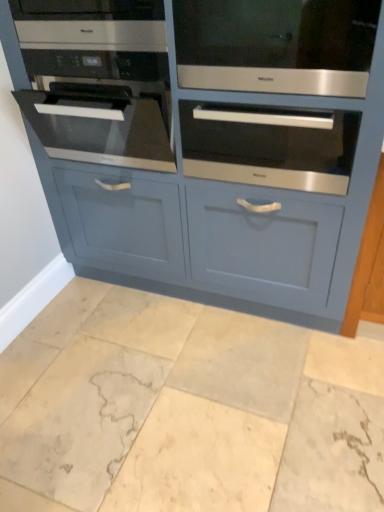
Question: Is matte blue cabinet at center directly adjacent to satin silver oven at center, which appears as the third oven when viewed from the left?

Choices:
 (A) yes
 (B) no

Answer: (B)

Question: Is matte blue cabinet at center thinner than satin silver oven at center, the 1th oven from the right?

Choices:
 (A) no
 (B) yes

Answer: (A)

Question: Is the position of matte blue cabinet at center more distant than that of satin silver oven at center, which appears as the third oven when viewed from the left?

Choices:
 (A) no
 (B) yes

Answer: (A)

Question: From a real-world perspective, is matte blue cabinet at center positioned over satin silver oven at center, which appears as the third oven when viewed from the left, based on gravity?

Choices:
 (A) no
 (B) yes

Answer: (A)

Question: From a real-world perspective, is matte blue cabinet at center under satin silver oven at center, the 1th oven from the right?

Choices:
 (A) no
 (B) yes

Answer: (B)

Question: Is matte blue cabinet at center facing away from satin silver oven at center, which appears as the third oven when viewed from the left?

Choices:
 (A) yes
 (B) no

Answer: (A)

Question: Is satin black oven at left, placed as the first oven when sorted from left to right, at the left side of satin silver oven at upper center, which is the 2th oven in left-to-right order?

Choices:
 (A) yes
 (B) no

Answer: (A)

Question: Is satin black oven at left, placed as the first oven when sorted from left to right, aimed at satin silver oven at upper center, which appears as the second oven when viewed from the right?

Choices:
 (A) no
 (B) yes

Answer: (A)

Question: Considering the relative sizes of satin black oven at left, which is the 3th oven in right-to-left order, and satin silver oven at upper center, which appears as the second oven when viewed from the right, in the image provided, is satin black oven at left, which is the 3th oven in right-to-left order, bigger than satin silver oven at upper center, which appears as the second oven when viewed from the right,?

Choices:
 (A) yes
 (B) no

Answer: (A)

Question: From a real-world perspective, does satin black oven at left, which is the 3th oven in right-to-left order, stand above satin silver oven at upper center, which appears as the second oven when viewed from the right?

Choices:
 (A) no
 (B) yes

Answer: (A)

Question: From the image's perspective, is satin black oven at left, which is the 3th oven in right-to-left order, below satin silver oven at upper center, which is the 2th oven in left-to-right order?

Choices:
 (A) yes
 (B) no

Answer: (A)

Question: Is satin black oven at left, placed as the first oven when sorted from left to right, turned away from satin silver oven at upper center, which appears as the second oven when viewed from the right?

Choices:
 (A) no
 (B) yes

Answer: (A)

Question: Are satin stainless steel oven at upper left and matte blue cabinet at center beside each other?

Choices:
 (A) yes
 (B) no

Answer: (B)